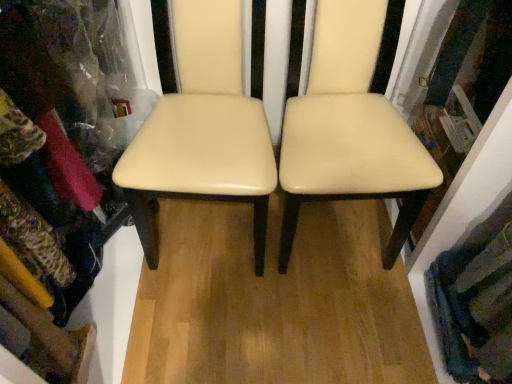
Question: In terms of width, does creamy leather chair at center, the 1th chair from the right, look wider or thinner when compared to cream leather chair at center, which is counted as the 1th chair, starting from the left?

Choices:
 (A) thin
 (B) wide

Answer: (B)

Question: From a real-world perspective, relative to cream leather chair at center, which is counted as the 1th chair, starting from the left, is creamy leather chair at center, the 1th chair from the right, vertically above or below?

Choices:
 (A) above
 (B) below

Answer: (A)

Question: Considering the real-world distances, which object is farthest from the creamy leather chair at center, which ranks as the 2th chair in left-to-right order?

Choices:
 (A) cream leather chair at center, placed as the second chair when sorted from right to left
 (B) textured wool scarf at lower right

Answer: (B)

Question: Which object is positioned farthest from the creamy leather chair at center, which ranks as the 2th chair in left-to-right order?

Choices:
 (A) textured wool scarf at lower right
 (B) cream leather chair at center, which is counted as the 1th chair, starting from the left

Answer: (A)